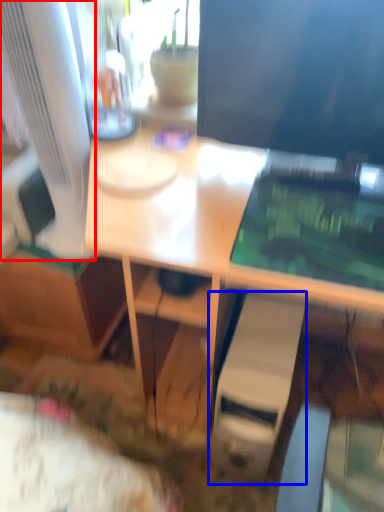
Question: Among these objects, which one is nearest to the camera, computer monitor (highlighted by a red box) or computer tower (highlighted by a blue box)?

Choices:
 (A) computer monitor
 (B) computer tower

Answer: (A)